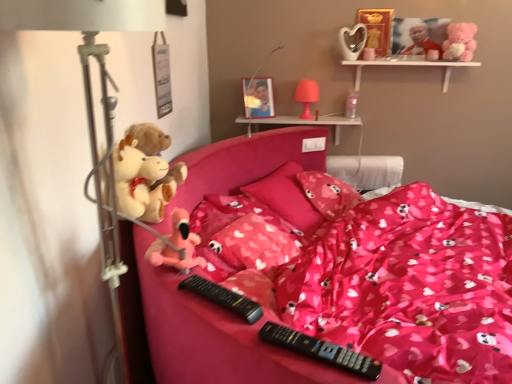
Where is `vacant area on top of pink satin blanket at center (from a real-world perspective)`? This screenshot has height=384, width=512. vacant area on top of pink satin blanket at center (from a real-world perspective) is located at coordinates (424, 281).